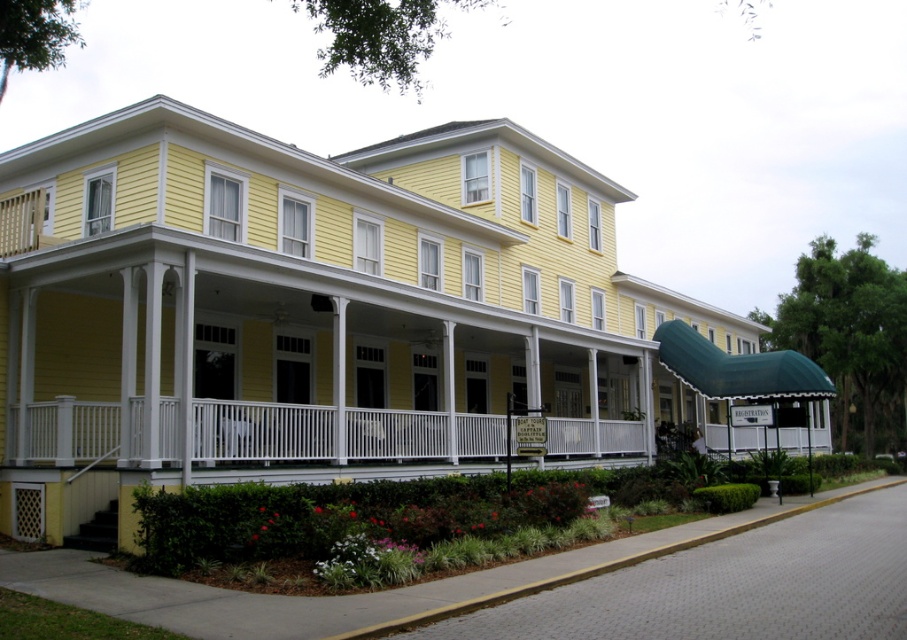
Question: Can you confirm if white painted wood porch at center is thinner than yellow concrete curb at lower center?

Choices:
 (A) yes
 (B) no

Answer: (A)

Question: Which point is closer to the camera?

Choices:
 (A) yellow concrete curb at lower center
 (B) white painted wood porch at center

Answer: (A)

Question: Considering the relative positions of white painted wood porch at center and yellow concrete curb at lower center in the image provided, where is white painted wood porch at center located with respect to yellow concrete curb at lower center?

Choices:
 (A) left
 (B) right

Answer: (A)

Question: Is white painted wood porch at center closer to camera compared to yellow concrete curb at lower center?

Choices:
 (A) no
 (B) yes

Answer: (A)

Question: Among these points, which one is nearest to the camera?

Choices:
 (A) (625, 557)
 (B) (610, 432)

Answer: (A)